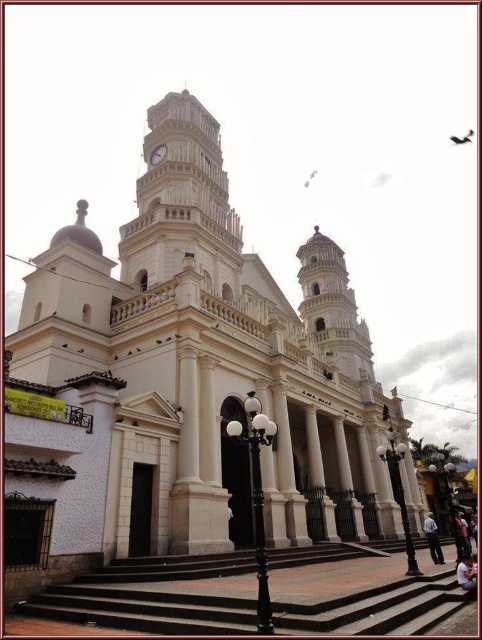
You are a tourist standing in front of the historic building and want to take a photo that includes both the white glossy lamp post at lower right and the gold metallic clock at upper center. Considering their sizes, which object should you focus on to ensure both are clearly visible in the frame?

The white glossy lamp post at lower right is larger in size than the gold metallic clock at upper center. To ensure both are clearly visible, focus on the white glossy lamp post at lower right as it is larger and will remain in focus while the smaller gold metallic clock at upper center will also be visible in the background.

You are standing in front of a historic building and want to locate the white stone clock tower at upper left. According to the coordinates provided, where exactly should you look?

You should look at point [183,202] to find the white stone clock tower at upper left.